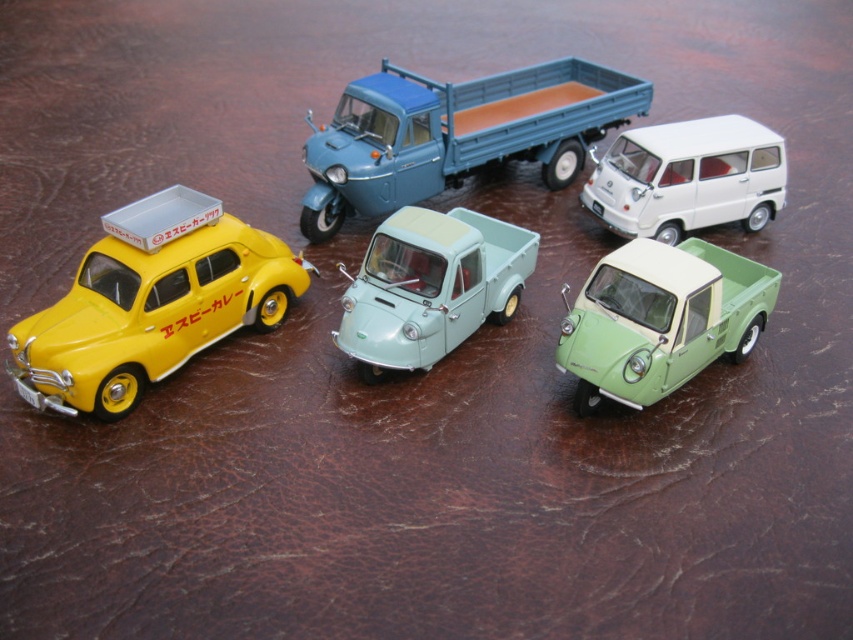
Which is more to the right, matte yellow car at left or light blue matte pickup truck at center?

light blue matte pickup truck at center

Measure the distance between point (280, 259) and camera.

The distance of point (280, 259) from camera is 1.67 meters.

Identify the location of matte yellow car at left. The width and height of the screenshot is (853, 640). (151, 301).

Between light blue matte pickup truck at center and white matte van at upper right, which one has less height?

white matte van at upper right is shorter.

Does light blue matte pickup truck at center have a greater height compared to white matte van at upper right?

Yes, light blue matte pickup truck at center is taller than white matte van at upper right.

Is point (457, 280) in front of point (663, 205)?

Yes, it is.

At what (x,y) coordinates should I click in order to perform the action: click on light blue matte pickup truck at center. Please return your answer as a coordinate pair (x, y). The image size is (853, 640). Looking at the image, I should click on (431, 285).

Based on the photo, between blue matte truck at upper center and white matte van at upper right, which one is positioned higher?

blue matte truck at upper center

Is blue matte truck at upper center positioned in front of white matte van at upper right?

Yes.

Between point (347, 97) and point (767, 180), which one is positioned in front?

Positioned in front is point (347, 97).

Locate an element on the screen. Image resolution: width=853 pixels, height=640 pixels. blue matte truck at upper center is located at coordinates (456, 132).